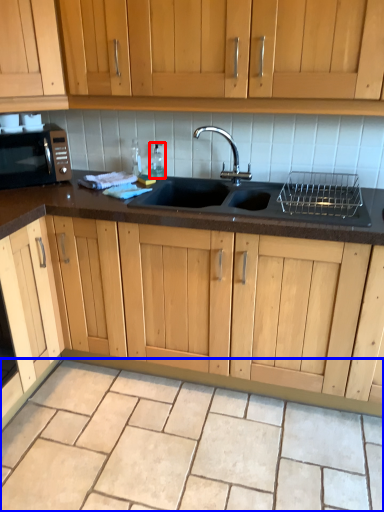
Question: Which of the following is the farthest to the observer, bottle (highlighted by a red box) or granite (highlighted by a blue box)?

Choices:
 (A) bottle
 (B) granite

Answer: (A)